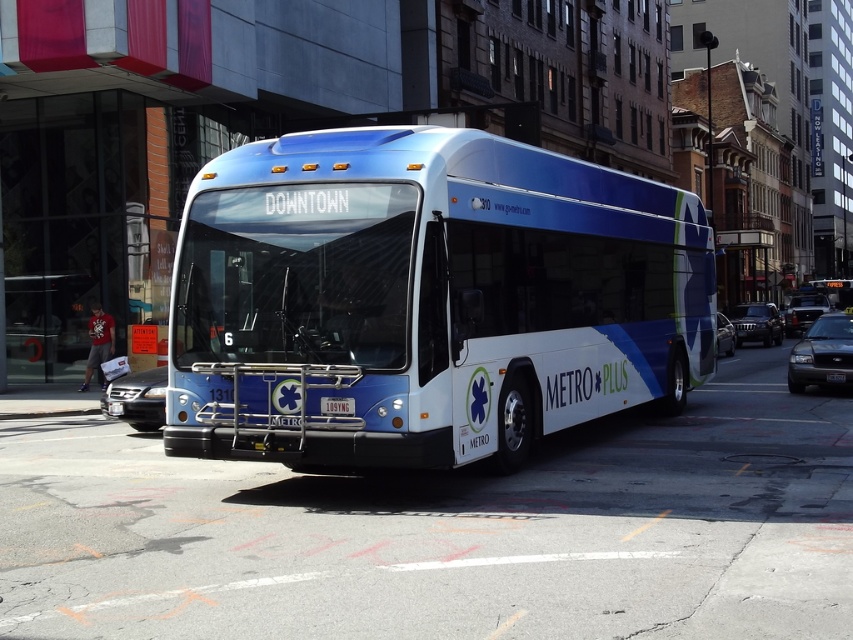
You are a pedestrian standing at the bus stop in front of the METRO PLUS bus. You need to cross the street to reach the park on the other side. Is the metallic silver sedan at right blocking your path?

The metallic silver sedan at right is located at point (804, 310), which is near the edge of the scene, so it might not be directly blocking your path to cross the street. However, you should check for moving vehicles before crossing for safety.

In the scene shown: You are a pedestrian standing at the bus stop. You see the metallic blue bus at center and the silver metallic sedan at lower left. Which vehicle is closer to you?

The metallic blue bus at center is closer to you since it is in front of the silver metallic sedan at lower left.

You are a pedestrian standing at the bus stop looking at the metallic blue bus at center and the black plastic license plate at center. Which object is closer to your left side?

The metallic blue bus at center is to the left of the black plastic license plate at center, so it is closer to your left side.